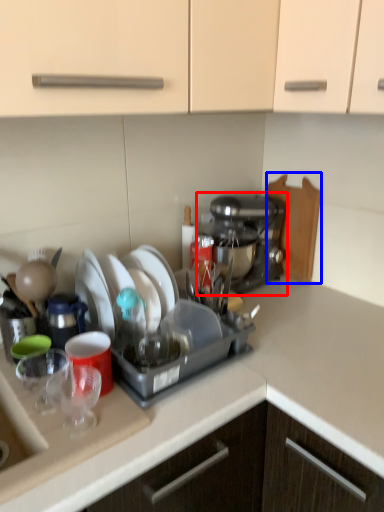
Question: Which of the following is the closest to the observer, coffee maker (highlighted by a red box) or cutting board (highlighted by a blue box)?

Choices:
 (A) coffee maker
 (B) cutting board

Answer: (A)